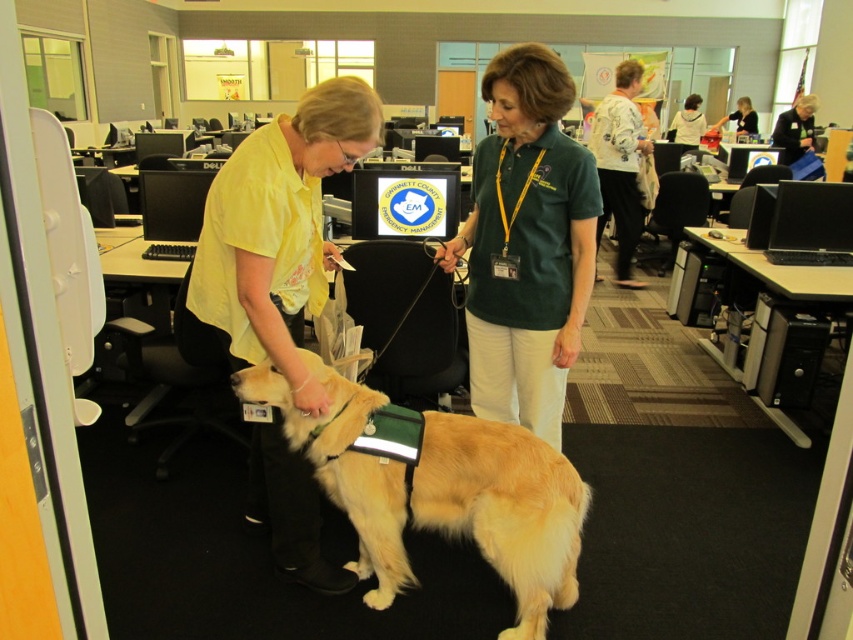
Question: Can you confirm if black shirt at upper right is wider than dark hair at center?

Choices:
 (A) yes
 (B) no

Answer: (A)

Question: Does golden fur dog at center have a greater width compared to white textured shirt at upper center?

Choices:
 (A) no
 (B) yes

Answer: (B)

Question: Which object appears closest to the camera in this image?

Choices:
 (A) black shirt at upper right
 (B) golden fur dog at center
 (C) yellow shirt at center
 (D) green shirt at center

Answer: (C)

Question: Which of the following is the farthest from the observer?

Choices:
 (A) green shirt at center
 (B) dark hair at center
 (C) golden fur dog at center
 (D) black shirt at upper right

Answer: (B)

Question: Does green shirt at center come in front of golden fur dog at center?

Choices:
 (A) yes
 (B) no

Answer: (B)

Question: Which point is farther from the camera taking this photo?

Choices:
 (A) (631, 147)
 (B) (805, 113)

Answer: (B)